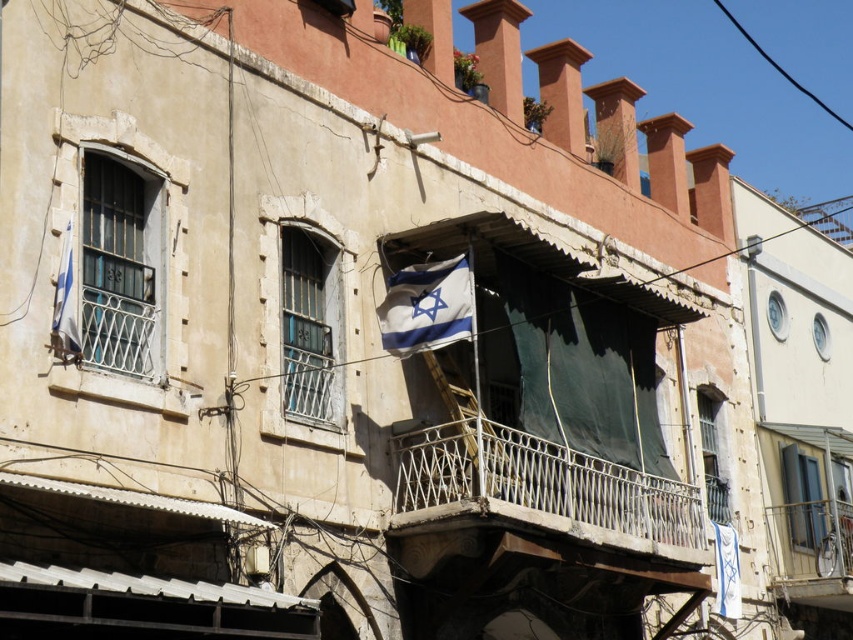
You are a drone operator trying to capture a photo of the metallic white balcony at center. Your drone is currently at the point with coordinates 0.5, 0.5. Which direction should you move the drone to reach the balcony?

The metallic white balcony at center is located at coordinates [541,490], which is northeast of the current position at [426,320]. Move the drone northeast to reach the balcony.

You are standing on the ground floor of the building and want to reach the metallic white balcony at center. Given that the average human stride is 0.75 meters, how many strides would you need to take to reach the balcony?

The metallic white balcony at center is 52.38 meters away from the viewer. With an average stride of 0.75 meters, you would need approximately 52.38 divided by 0.75, which equals about 70 strides to reach the balcony.